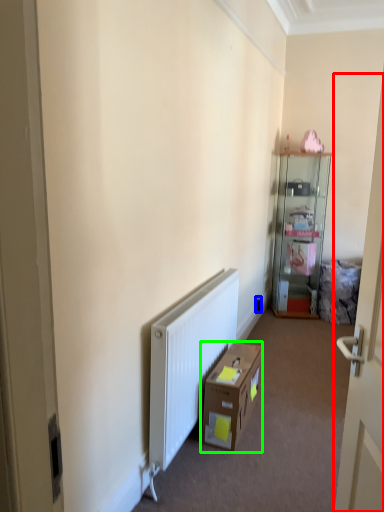
Question: Which is nearer to the door (highlighted by a red box)? electric outlet (highlighted by a blue box) or cardboard box (highlighted by a green box).

Choices:
 (A) electric outlet
 (B) cardboard box

Answer: (B)